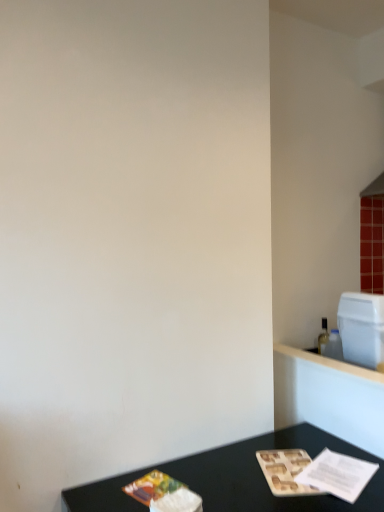
Question: Is there a large distance between white plastic container at upper right and black matte table at lower center?

Choices:
 (A) yes
 (B) no

Answer: (B)

Question: Is white plastic container at upper right shorter than black matte table at lower center?

Choices:
 (A) no
 (B) yes

Answer: (B)

Question: Does white plastic container at upper right lie in front of black matte table at lower center?

Choices:
 (A) yes
 (B) no

Answer: (B)

Question: From the image's perspective, is white plastic container at upper right over black matte table at lower center?

Choices:
 (A) yes
 (B) no

Answer: (A)

Question: Does white plastic container at upper right appear on the right side of black matte table at lower center?

Choices:
 (A) no
 (B) yes

Answer: (B)

Question: Can you see white plastic container at upper right touching black matte table at lower center?

Choices:
 (A) no
 (B) yes

Answer: (A)

Question: Does black matte table at lower center have a greater width compared to white plastic container at upper right?

Choices:
 (A) no
 (B) yes

Answer: (B)

Question: Does black matte table at lower center have a greater height compared to white plastic container at upper right?

Choices:
 (A) yes
 (B) no

Answer: (A)

Question: Is black matte table at lower center to the right of white plastic container at upper right from the viewer's perspective?

Choices:
 (A) no
 (B) yes

Answer: (A)

Question: Can you confirm if black matte table at lower center is bigger than white plastic container at upper right?

Choices:
 (A) yes
 (B) no

Answer: (A)

Question: Is black matte table at lower center smaller than white plastic container at upper right?

Choices:
 (A) no
 (B) yes

Answer: (A)

Question: Is white plastic container at upper right a part of black matte table at lower center?

Choices:
 (A) no
 (B) yes

Answer: (A)

Question: From the image's perspective, is white plastic container at upper right above or below black matte table at lower center?

Choices:
 (A) below
 (B) above

Answer: (B)